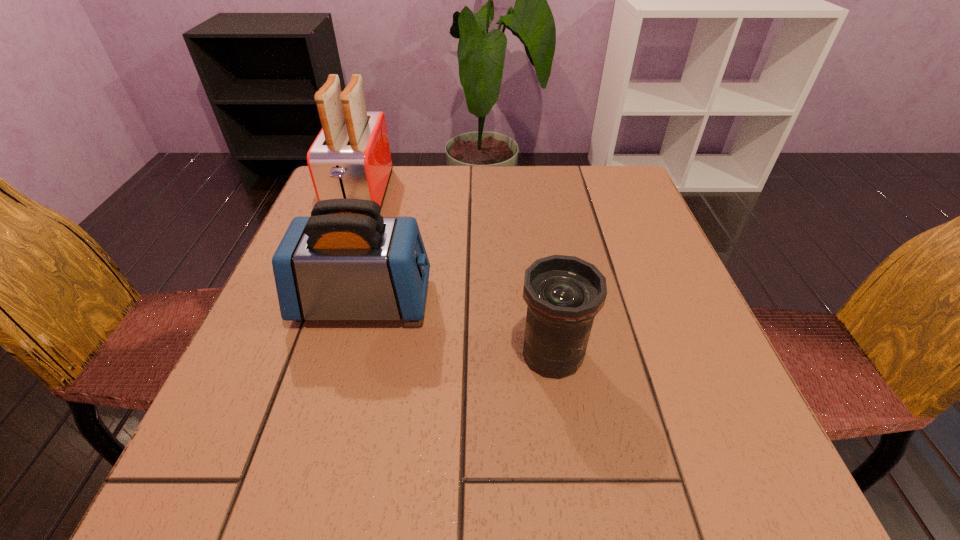
Find the location of a particular element. This screenshot has height=540, width=960. free space that satisfies the following two spatial constraints: 1. on the back side of the shortest object; 2. on the front-facing side of the shorter toaster is located at coordinates (544, 301).

Find the location of a particular element. The height and width of the screenshot is (540, 960). vacant region that satisfies the following two spatial constraints: 1. on the front-facing side of the rightmost object; 2. on the right side of the shorter toaster is located at coordinates (349, 354).

The height and width of the screenshot is (540, 960). In order to click on blank space that satisfies the following two spatial constraints: 1. on the front-facing side of the tallest object; 2. on the right side of the telephoto lens in this screenshot , I will do `click(302, 354)`.

Locate an element on the screen. The image size is (960, 540). free spot that satisfies the following two spatial constraints: 1. on the front-facing side of the farthest object; 2. on the left side of the shortest object is located at coordinates (302, 354).